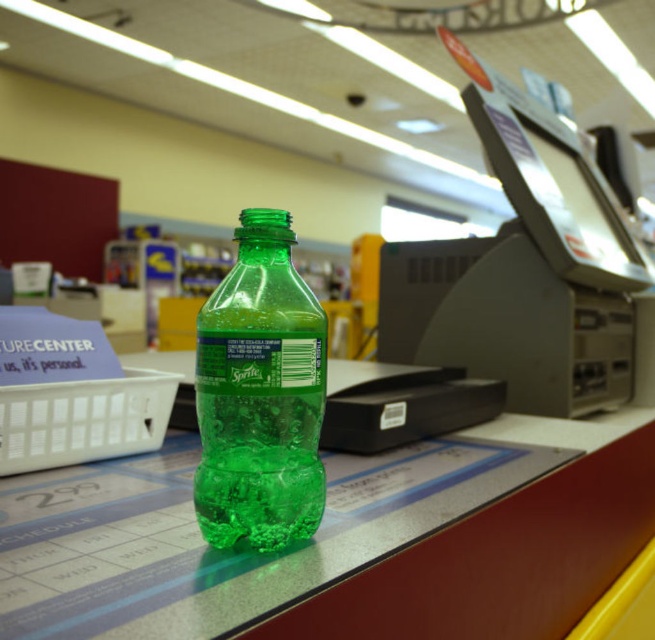
Question: Among these points, which one is nearest to the camera?

Choices:
 (A) (316, 465)
 (B) (605, 422)

Answer: (A)

Question: Is translucent plastic bottle at center bigger than green translucent plastic bottle at center?

Choices:
 (A) yes
 (B) no

Answer: (A)

Question: Which object appears closest to the camera in this image?

Choices:
 (A) green translucent plastic bottle at center
 (B) translucent plastic bottle at center

Answer: (B)

Question: In this image, where is translucent plastic bottle at center located relative to green translucent plastic bottle at center?

Choices:
 (A) right
 (B) left

Answer: (A)

Question: Considering the relative positions of translucent plastic bottle at center and green translucent plastic bottle at center in the image provided, where is translucent plastic bottle at center located with respect to green translucent plastic bottle at center?

Choices:
 (A) above
 (B) below

Answer: (B)